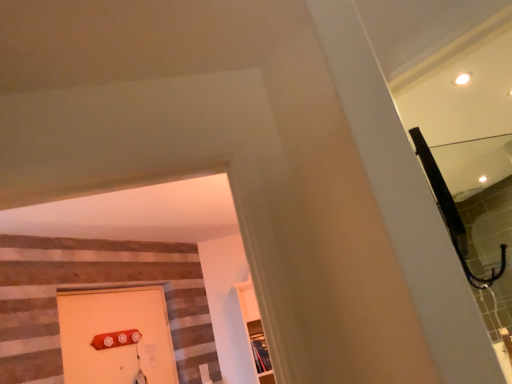
Measure the distance between matte orange door at lower left and camera.

matte orange door at lower left and camera are 8.32 feet apart from each other.

Where is `clear glass mirror at upper right`? This screenshot has width=512, height=384. clear glass mirror at upper right is located at coordinates (480, 214).

Where is `wooden shelf at center`? wooden shelf at center is located at coordinates (260, 352).

Considering the relative positions of clear glass mirror at upper right and wooden shelf at center in the image provided, is clear glass mirror at upper right to the left or to the right of wooden shelf at center?

clear glass mirror at upper right is to the right of wooden shelf at center.

In terms of height, does clear glass mirror at upper right look taller or shorter compared to wooden shelf at center?

In the image, clear glass mirror at upper right appears to be shorter than wooden shelf at center.

From the image's perspective, is clear glass mirror at upper right under wooden shelf at center?

Actually, clear glass mirror at upper right appears above wooden shelf at center in the image.

From a real-world perspective, who is located lower, clear glass mirror at upper right or wooden shelf at center?

wooden shelf at center, from a real-world perspective.

Considering the positions of points (75, 310) and (464, 198), is point (75, 310) farther from camera compared to point (464, 198)?

That is False.

From the image's perspective, does matte orange door at lower left appear higher than clear glass mirror at upper right?

No, from the image's perspective, matte orange door at lower left is not over clear glass mirror at upper right.

Is matte orange door at lower left placed right next to clear glass mirror at upper right?

They are not placed beside each other.

Relative to matte orange door at lower left, is clear glass mirror at upper right in front or behind?

clear glass mirror at upper right is in front of matte orange door at lower left.

Considering the sizes of objects clear glass mirror at upper right and matte orange door at lower left in the image provided, who is thinner, clear glass mirror at upper right or matte orange door at lower left?

With smaller width is clear glass mirror at upper right.

From a real-world perspective, is clear glass mirror at upper right physically above matte orange door at lower left?

Actually, clear glass mirror at upper right is physically below matte orange door at lower left in the real world.

Considering the sizes of clear glass mirror at upper right and matte orange door at lower left in the image, is clear glass mirror at upper right taller or shorter than matte orange door at lower left?

In the image, clear glass mirror at upper right appears to be shorter than matte orange door at lower left.

Can you confirm if wooden shelf at center is taller than clear glass mirror at upper right?

Yes, wooden shelf at center is taller than clear glass mirror at upper right.

From the image's perspective, between wooden shelf at center and clear glass mirror at upper right, which one is located above?

clear glass mirror at upper right.

In the scene shown: Is wooden shelf at center positioned beyond the bounds of clear glass mirror at upper right?

Yes.

Can you confirm if wooden shelf at center is bigger than clear glass mirror at upper right?

Yes.

Does matte orange door at lower left have a greater height compared to wooden shelf at center?

Yes.

From the image's perspective, is matte orange door at lower left located above or below wooden shelf at center?

matte orange door at lower left is above wooden shelf at center.

Can we say matte orange door at lower left lies outside wooden shelf at center?

Yes, matte orange door at lower left is located beyond the bounds of wooden shelf at center.

From a real-world perspective, does wooden shelf at center stand above matte orange door at lower left?

No.

From the image's perspective, which object appears higher, wooden shelf at center or matte orange door at lower left?

From the image's view, matte orange door at lower left is above.

Who is shorter, wooden shelf at center or matte orange door at lower left?

Standing shorter between the two is wooden shelf at center.

Find the location of a particular element. The height and width of the screenshot is (384, 512). shelf below the clear glass mirror at upper right (from the image's perspective) is located at coordinates (260, 352).

Where is `mirror in front of the matte orange door at lower left`? The width and height of the screenshot is (512, 384). mirror in front of the matte orange door at lower left is located at coordinates (480, 214).

Based on their spatial positions, is wooden shelf at center or matte orange door at lower left closer to clear glass mirror at upper right?

wooden shelf at center is positioned closer to the anchor clear glass mirror at upper right.

Looking at the image, which one is located closer to wooden shelf at center, matte orange door at lower left or clear glass mirror at upper right?

Based on the image, matte orange door at lower left appears to be nearer to wooden shelf at center.

Consider the image. When comparing their distances from matte orange door at lower left, does wooden shelf at center or clear glass mirror at upper right seem further?

Based on the image, clear glass mirror at upper right appears to be further to matte orange door at lower left.

From the image, which object appears to be farther from clear glass mirror at upper right, matte orange door at lower left or wooden shelf at center?

The object further to clear glass mirror at upper right is matte orange door at lower left.

When comparing their distances from wooden shelf at center, does clear glass mirror at upper right or matte orange door at lower left seem further?

The object further to wooden shelf at center is clear glass mirror at upper right.

In the scene shown: Considering their positions, is clear glass mirror at upper right positioned closer to matte orange door at lower left than wooden shelf at center?

wooden shelf at center lies closer to matte orange door at lower left than the other object.

Where is `door between clear glass mirror at upper right and wooden shelf at center along the z-axis`? door between clear glass mirror at upper right and wooden shelf at center along the z-axis is located at coordinates (116, 336).